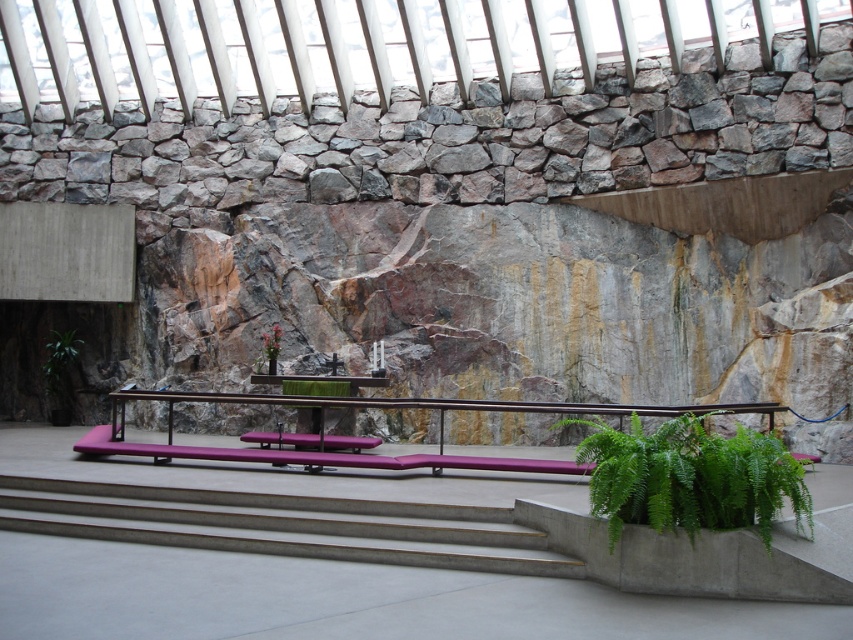
Can you confirm if green leafy plant at lower right is positioned above green leafy plant at lower left?

Incorrect, green leafy plant at lower right is not positioned above green leafy plant at lower left.

Is point (749, 429) positioned before point (65, 392)?

Yes, it is.

Who is more forward, (680, 518) or (51, 376)?

Positioned in front is point (680, 518).

The image size is (853, 640). What are the coordinates of `green leafy plant at lower right` in the screenshot? It's located at (689, 477).

Identify the location of green leafy plant at lower right. (689, 477).

Who is more forward, [795,492] or [277,330]?

Point [795,492] is in front.

Does point (735, 516) lie in front of point (277, 328)?

Yes, point (735, 516) is closer to viewer.

Where is `green leafy plant at lower right`? The height and width of the screenshot is (640, 853). green leafy plant at lower right is located at coordinates (689, 477).

Identify the location of green leafy plant at lower left. (61, 364).

Which is behind, point (67, 340) or point (270, 358)?

Point (67, 340)

The image size is (853, 640). Identify the location of green leafy plant at lower left. (61, 364).